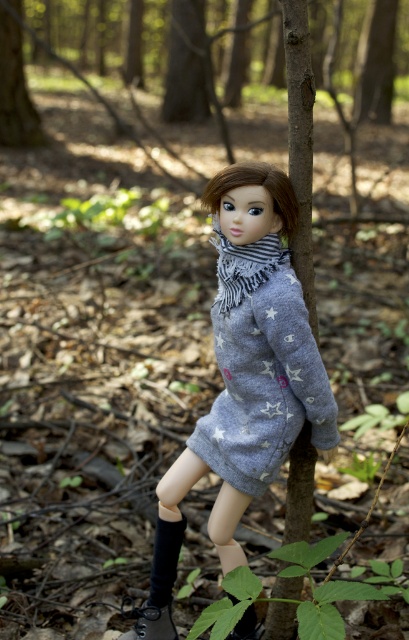
Between brown rough bark at upper left and gray striped scarf at center, which one is positioned lower?

gray striped scarf at center

Between brown rough bark at upper left and gray striped scarf at center, which one is positioned higher?

brown rough bark at upper left

Describe the element at coordinates (15, 90) in the screenshot. I see `brown rough bark at upper left` at that location.

Image resolution: width=409 pixels, height=640 pixels. Find the location of `brown rough bark at upper left`. brown rough bark at upper left is located at coordinates (15, 90).

From the picture: Can you confirm if gray soft fabric dress at center is shorter than gray knitted dress at center?

No, gray soft fabric dress at center is not shorter than gray knitted dress at center.

Between point (242, 428) and point (283, 387), which one is positioned in front?

Point (283, 387) is more forward.

Find the location of a particular element. The width and height of the screenshot is (409, 640). gray soft fabric dress at center is located at coordinates (244, 378).

Measure the distance from gray knitted dress at center to gray striped scarf at center.

gray knitted dress at center is 21.24 centimeters from gray striped scarf at center.

The image size is (409, 640). What do you see at coordinates (262, 368) in the screenshot? I see `gray knitted dress at center` at bounding box center [262, 368].

Measure the distance between point (310,342) and camera.

Point (310,342) and camera are 1.95 meters apart.

Where is `gray knitted dress at center`? gray knitted dress at center is located at coordinates (262, 368).